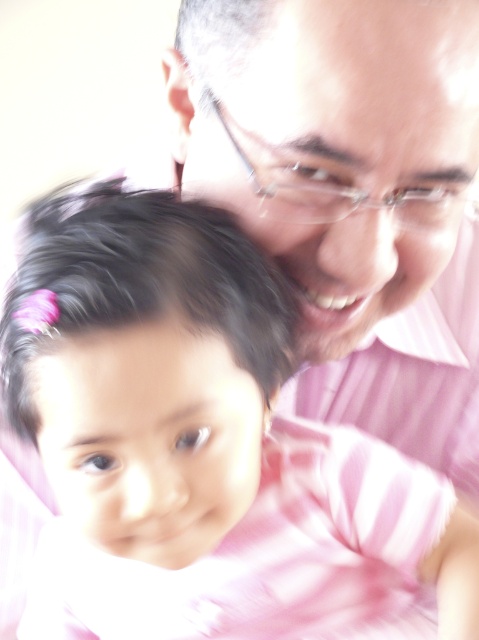
Which is more to the left, pink striped shirt at center or clear plastic glasses at upper center?

From the viewer's perspective, pink striped shirt at center appears more on the left side.

Who is more distant from viewer, (x=203, y=563) or (x=438, y=218)?

Positioned behind is point (x=203, y=563).

You are a GUI agent. You are given a task and a screenshot of the screen. Output one action in this format:
    pyautogui.click(x=<x>, y=<y>)
    Task: Click on the pink striped shirt at center
    
    Given the screenshot: What is the action you would take?
    pyautogui.click(x=196, y=440)